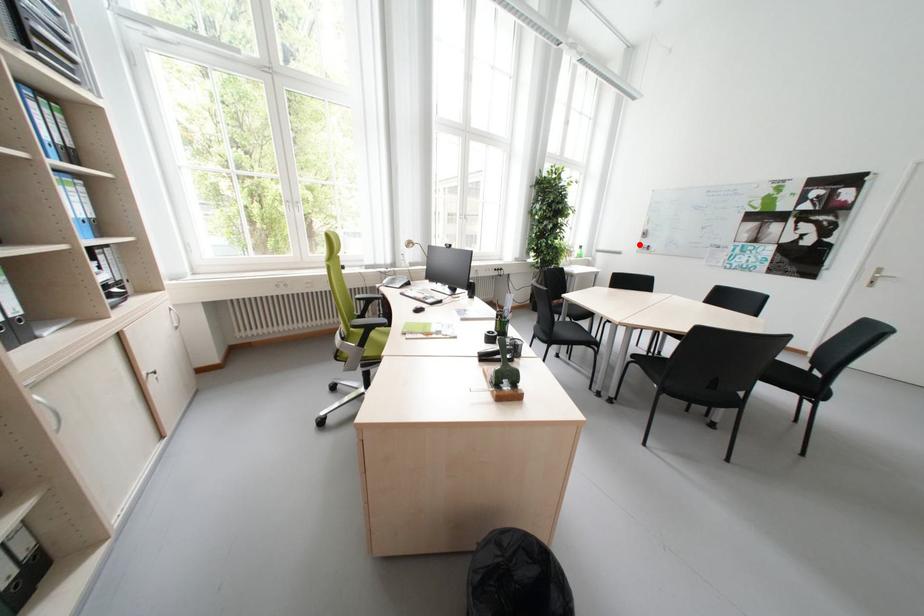
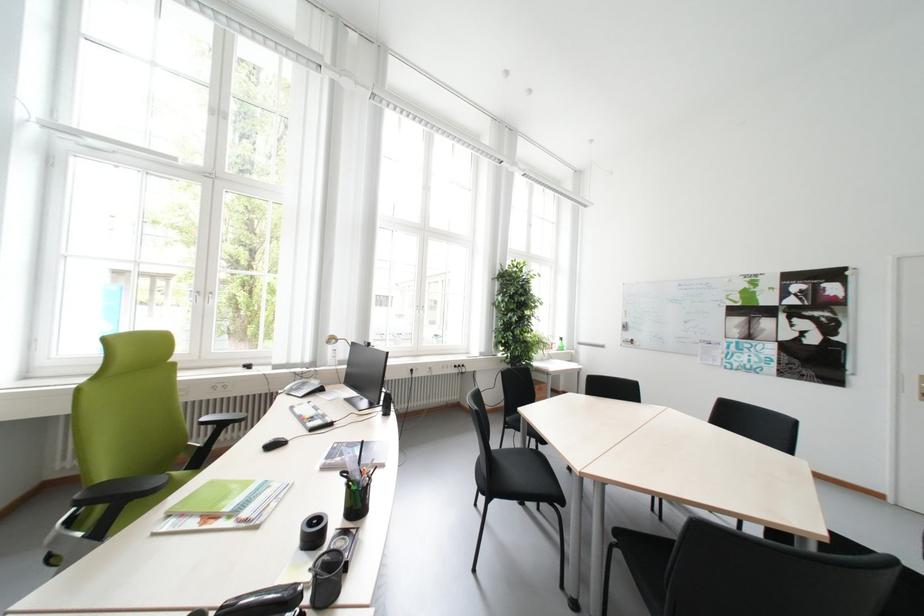
Find the pixel in the second image that matches the highlighted location in the first image.

(621, 338)